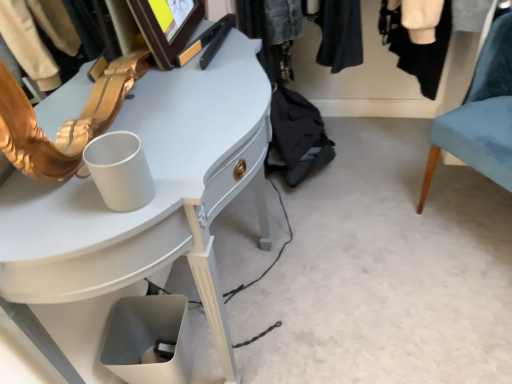
Question: Considering the relative positions of white glossy desk at upper left and denim jacket at upper center in the image provided, is white glossy desk at upper left behind denim jacket at upper center?

Choices:
 (A) yes
 (B) no

Answer: (B)

Question: Is white glossy desk at upper left in contact with denim jacket at upper center?

Choices:
 (A) no
 (B) yes

Answer: (A)

Question: Can you confirm if white glossy desk at upper left is wider than denim jacket at upper center?

Choices:
 (A) yes
 (B) no

Answer: (B)

Question: Is white glossy desk at upper left in front of denim jacket at upper center?

Choices:
 (A) yes
 (B) no

Answer: (A)

Question: Considering the relative sizes of white glossy desk at upper left and denim jacket at upper center in the image provided, is white glossy desk at upper left shorter than denim jacket at upper center?

Choices:
 (A) no
 (B) yes

Answer: (A)

Question: From the image's perspective, is white glossy desk at upper left located above denim jacket at upper center?

Choices:
 (A) yes
 (B) no

Answer: (B)

Question: Does velvet teal chair at right lie behind denim jacket at upper center?

Choices:
 (A) yes
 (B) no

Answer: (B)

Question: Is velvet teal chair at right not within denim jacket at upper center?

Choices:
 (A) yes
 (B) no

Answer: (A)

Question: Considering the relative sizes of velvet teal chair at right and denim jacket at upper center in the image provided, is velvet teal chair at right thinner than denim jacket at upper center?

Choices:
 (A) yes
 (B) no

Answer: (A)

Question: Is velvet teal chair at right to the right of denim jacket at upper center from the viewer's perspective?

Choices:
 (A) yes
 (B) no

Answer: (A)

Question: Would you say velvet teal chair at right is a long distance from denim jacket at upper center?

Choices:
 (A) yes
 (B) no

Answer: (B)

Question: Considering the relative sizes of velvet teal chair at right and denim jacket at upper center in the image provided, is velvet teal chair at right smaller than denim jacket at upper center?

Choices:
 (A) no
 (B) yes

Answer: (B)

Question: From a real-world perspective, is velvet teal chair at right physically below white glossy desk at upper left?

Choices:
 (A) no
 (B) yes

Answer: (B)